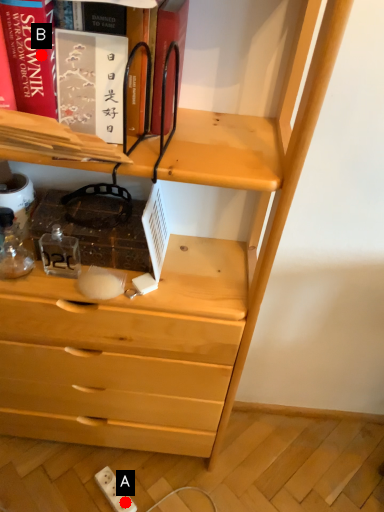
Question: Two points are circled on the image, labeled by A and B beside each circle. Which point appears farthest from the camera in this image?

Choices:
 (A) A is further
 (B) B is further

Answer: (A)